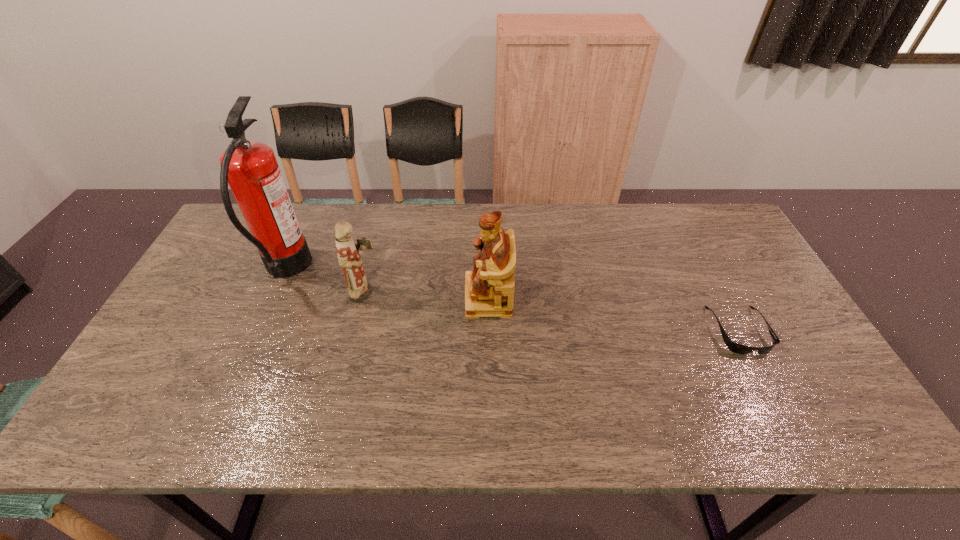
Locate an element on the screen. the leftmost object is located at coordinates (250, 168).

At what (x,y) coordinates should I click in order to perform the action: click on the tallest object. Please return your answer as a coordinate pair (x, y). The image size is (960, 540). Looking at the image, I should click on (250, 168).

The width and height of the screenshot is (960, 540). I want to click on the third object from left to right, so click(489, 289).

Find the location of a particular element. the left figurine is located at coordinates (348, 254).

The height and width of the screenshot is (540, 960). In order to click on the shortest object in this screenshot , I will do `click(734, 347)`.

In order to click on the rightmost object in this screenshot , I will do `click(734, 347)`.

Find the location of `free region located 0.350m on the front-facing side of the tallest object`. free region located 0.350m on the front-facing side of the tallest object is located at coordinates (424, 270).

Locate an element on the screen. free space located 0.200m on the front-facing side of the third object from left to right is located at coordinates (395, 298).

Where is `vacant space situated 0.250m on the front-facing side of the third object from left to right`? Image resolution: width=960 pixels, height=540 pixels. vacant space situated 0.250m on the front-facing side of the third object from left to right is located at coordinates (377, 298).

The image size is (960, 540). What are the coordinates of `vacant area located 0.090m on the front-facing side of the third object from left to right` in the screenshot? It's located at click(433, 298).